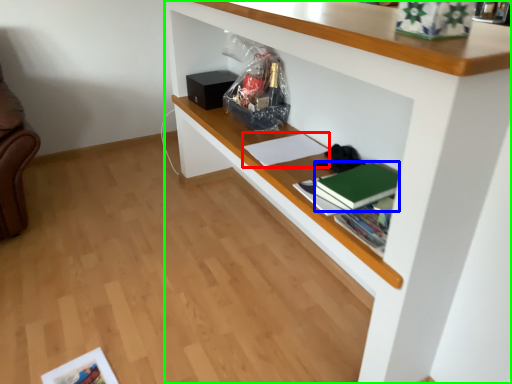
Question: Considering the real-world distances, which object is closest to book (highlighted by a red box)? paperback book (highlighted by a blue box) or shelf (highlighted by a green box).

Choices:
 (A) paperback book
 (B) shelf

Answer: (A)